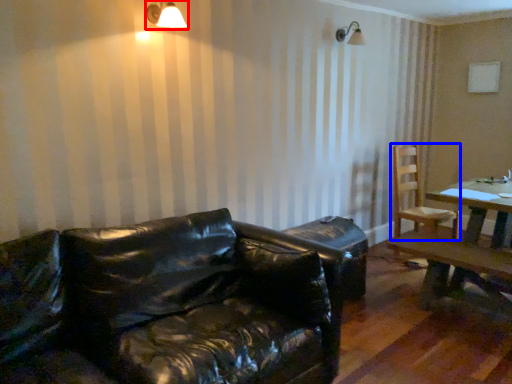
Question: Which of the following is the farthest to the observer, light fixture (highlighted by a red box) or chair (highlighted by a blue box)?

Choices:
 (A) light fixture
 (B) chair

Answer: (B)